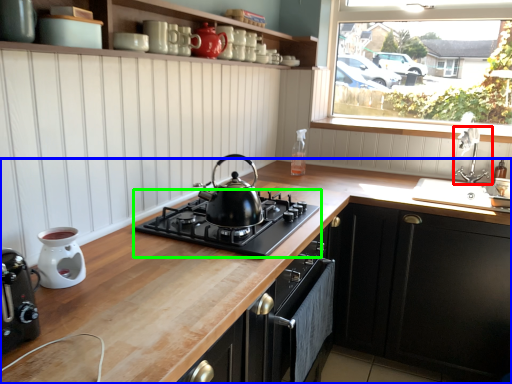
Question: Estimate the real-world distances between objects in this image. Which object is farther from tap (highlighted by a red box), countertop (highlighted by a blue box) or gas stove (highlighted by a green box)?

Choices:
 (A) countertop
 (B) gas stove

Answer: (B)